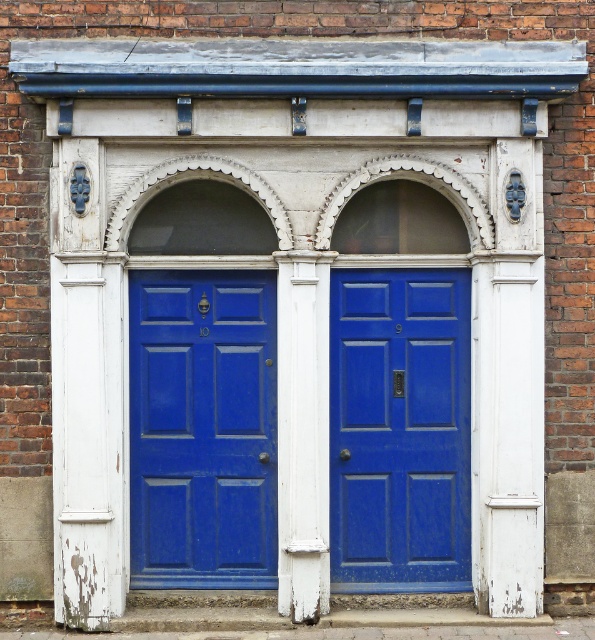
Question: Which point appears closest to the camera in this image?

Choices:
 (A) (158, 372)
 (B) (309, 436)
 (C) (393, 534)

Answer: (B)

Question: Does matte blue door at center appear on the left side of white painted wood pillar at center?

Choices:
 (A) no
 (B) yes

Answer: (A)

Question: Considering the real-world distances, which object is farthest from the white painted wood pillar at center?

Choices:
 (A) matte blue door at left
 (B) matte blue door at center

Answer: (B)

Question: Is matte blue door at left in front of matte blue door at center?

Choices:
 (A) no
 (B) yes

Answer: (A)

Question: Which object appears closest to the camera in this image?

Choices:
 (A) matte blue door at center
 (B) matte blue door at left

Answer: (A)

Question: Can you confirm if matte blue door at left is smaller than matte blue door at center?

Choices:
 (A) yes
 (B) no

Answer: (A)